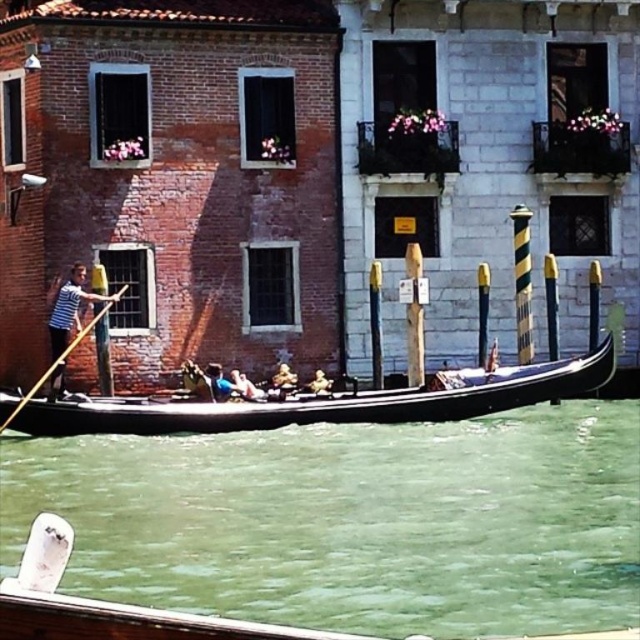
You are standing on the gondola and see the point marked at coordinates (353, 520). What is located at that point?

The point at coordinates (353, 520) marks green water at lower center.

You are an art student analyzing the central elements of the image. The golden textured statue at center and the smooth golden helmet at center are both made of gold. Which one has a more detailed surface texture?

The golden textured statue at center has a more detailed surface texture compared to the smooth golden helmet at center.

You are a tourist in Venice and want to take a photo of both the black polished wood gondola at center and the smooth golden helmet at center. Which object should you focus on first if you want to capture both in one frame without zooming in or out?

Answer: You should focus on the black polished wood gondola at center first because it is larger in size than the smooth golden helmet at center, so it will take up more space in the frame and ensure both are visible without needing to adjust the zoom.